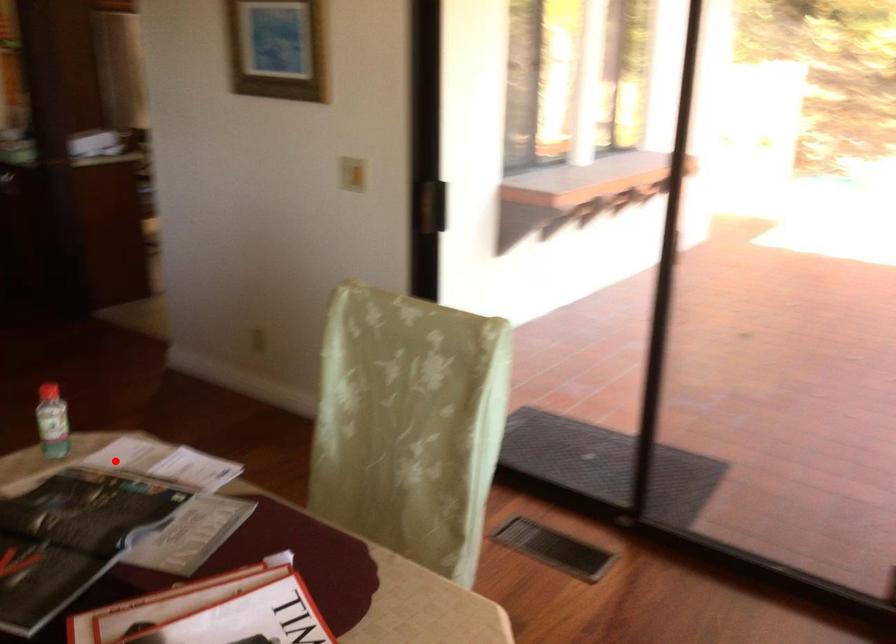
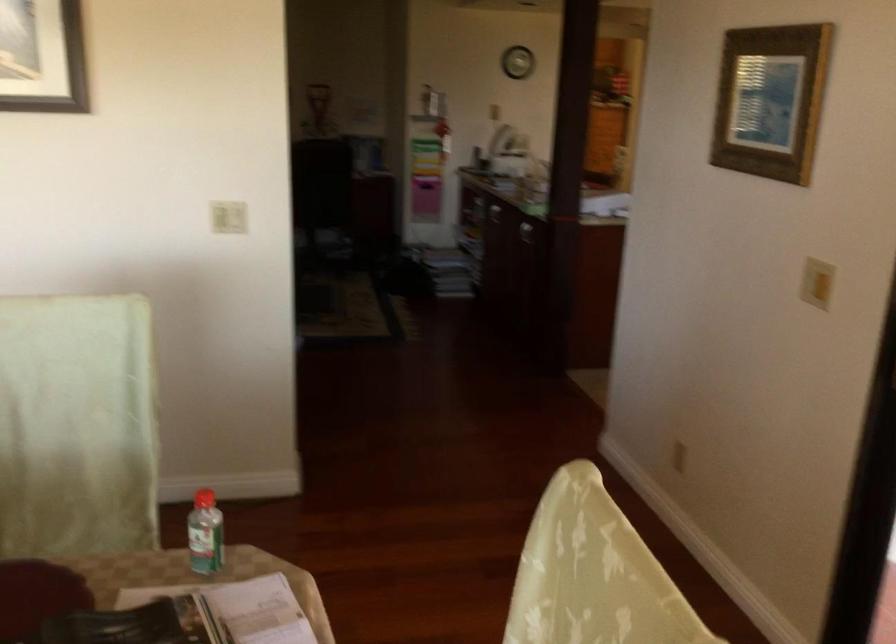
Question: I am providing you with two images of the same scene from different viewpoints. A red point is marked on the first image. At the location where the point appears in image 1, is it still visible in image 2?

Choices:
 (A) Yes
 (B) No

Answer: (A)